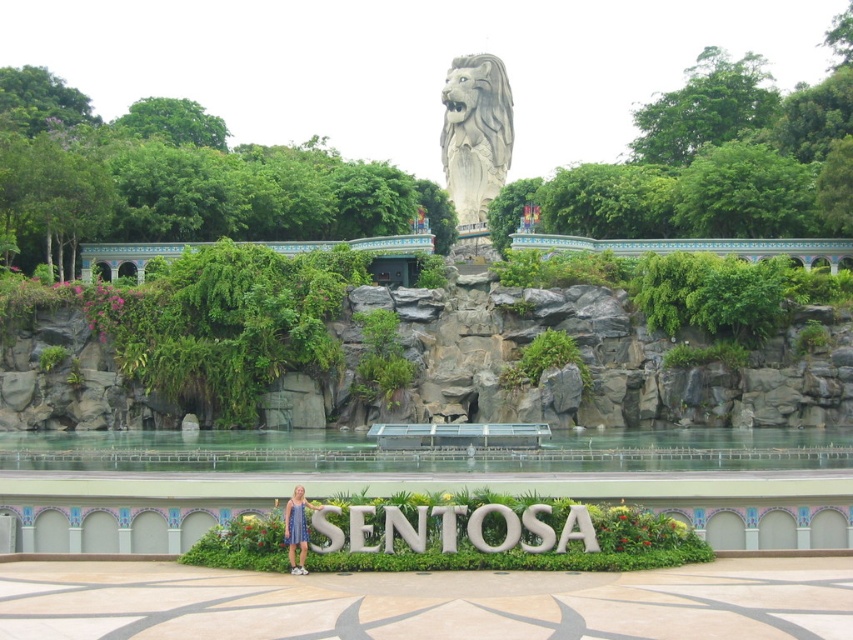
Question: Which point is farther from the camera taking this photo?

Choices:
 (A) (294, 531)
 (B) (495, 96)

Answer: (B)

Question: Where is gray stone lion at upper center located in relation to blue fabric dress at lower center in the image?

Choices:
 (A) right
 (B) left

Answer: (A)

Question: Which point is closer to the camera?

Choices:
 (A) blue fabric dress at lower center
 (B) gray stone lion at upper center

Answer: (A)

Question: Is gray stone lion at upper center positioned behind blue fabric dress at lower center?

Choices:
 (A) yes
 (B) no

Answer: (A)

Question: Which point is closer to the camera?

Choices:
 (A) click(x=508, y=145)
 (B) click(x=287, y=520)

Answer: (B)

Question: Does gray stone lion at upper center appear on the left side of blue fabric dress at lower center?

Choices:
 (A) yes
 (B) no

Answer: (B)